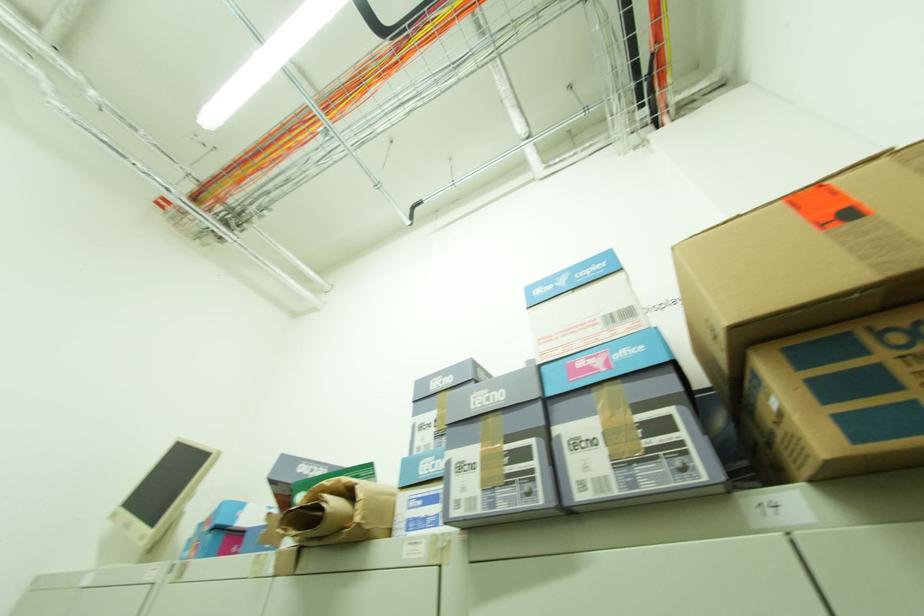
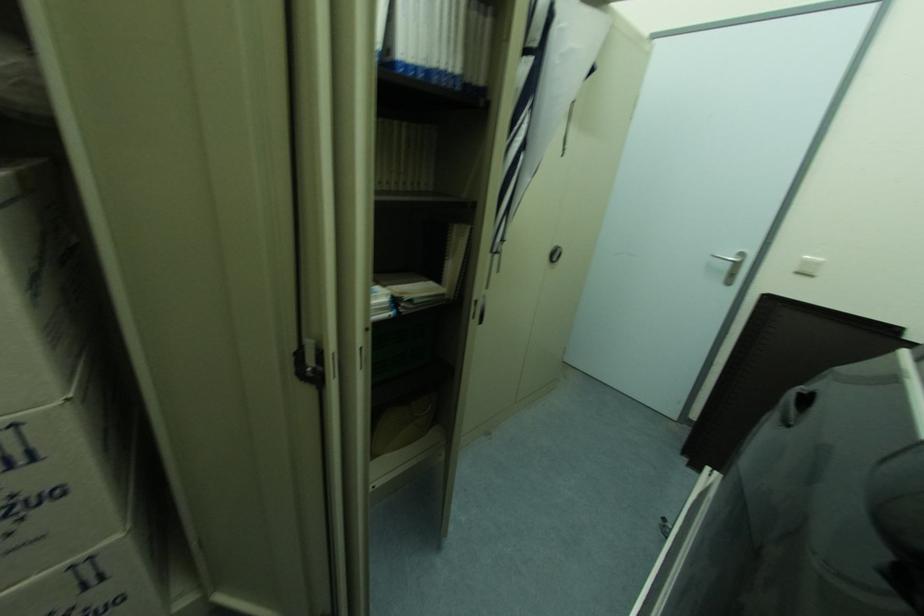
Question: The first image is from the beginning of the video and the second image is from the end. How did the camera likely rotate when shooting the video?

Choices:
 (A) Left
 (B) Right
 (C) Up
 (D) Down

Answer: (A)